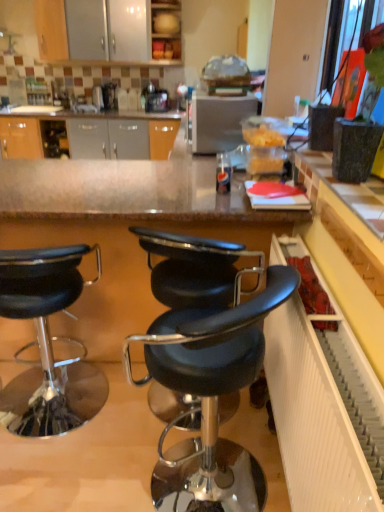
Question: Considering the relative sizes of black leather stool at center, which is counted as the 2th chair, starting from the left, and black leather stool at left, the 3th chair from the right, in the image provided, is black leather stool at center, which is counted as the 2th chair, starting from the left, smaller than black leather stool at left, the 3th chair from the right,?

Choices:
 (A) no
 (B) yes

Answer: (B)

Question: Can you confirm if black leather stool at center, which is counted as the 2th chair, starting from the left, is positioned to the right of black leather stool at left, which is the 1th chair in left-to-right order?

Choices:
 (A) no
 (B) yes

Answer: (B)

Question: Is black leather stool at center, which is counted as the 2th chair, starting from the left, shorter than black leather stool at left, which is the 1th chair in left-to-right order?

Choices:
 (A) no
 (B) yes

Answer: (A)

Question: Does black leather stool at center, which ranks as the second chair in right-to-left order, have a greater width compared to black leather stool at left, the 3th chair from the right?

Choices:
 (A) no
 (B) yes

Answer: (A)

Question: Is black leather stool at center, which ranks as the second chair in right-to-left order, thinner than black leather stool at left, which is the 1th chair in left-to-right order?

Choices:
 (A) no
 (B) yes

Answer: (B)

Question: Is black leather stool at center, which is counted as the 2th chair, starting from the left, in front of black leather stool at left, the 3th chair from the right?

Choices:
 (A) no
 (B) yes

Answer: (A)

Question: From a real-world perspective, does black leather stool at center, which ranks as the 1th chair in right-to-left order, stand above satin silver toaster at center?

Choices:
 (A) yes
 (B) no

Answer: (B)

Question: From the image's perspective, is black leather stool at center, which ranks as the 1th chair in right-to-left order, on satin silver toaster at center?

Choices:
 (A) yes
 (B) no

Answer: (B)

Question: Is black leather stool at center, placed as the third chair when sorted from left to right, positioned with its back to satin silver toaster at center?

Choices:
 (A) no
 (B) yes

Answer: (A)

Question: Can we say black leather stool at center, placed as the third chair when sorted from left to right, lies outside satin silver toaster at center?

Choices:
 (A) no
 (B) yes

Answer: (B)

Question: Does black leather stool at center, which ranks as the 1th chair in right-to-left order, have a lesser height compared to satin silver toaster at center?

Choices:
 (A) yes
 (B) no

Answer: (B)

Question: Is black leather stool at center, which ranks as the 1th chair in right-to-left order, smaller than satin silver toaster at center?

Choices:
 (A) yes
 (B) no

Answer: (B)

Question: Does satin silver toaster at center come behind black leather stool at center, placed as the third chair when sorted from left to right?

Choices:
 (A) no
 (B) yes

Answer: (B)